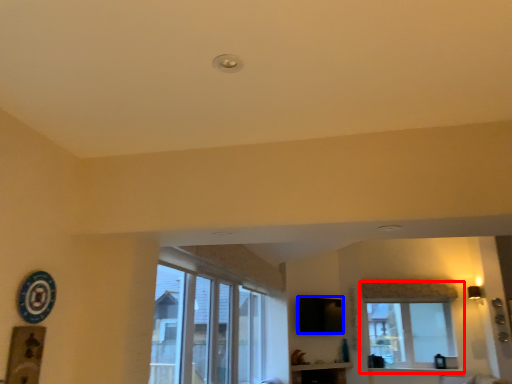
Question: Which point is closer to the camera, window (highlighted by a red box) or window screen (highlighted by a blue box)?

Choices:
 (A) window
 (B) window screen

Answer: (B)